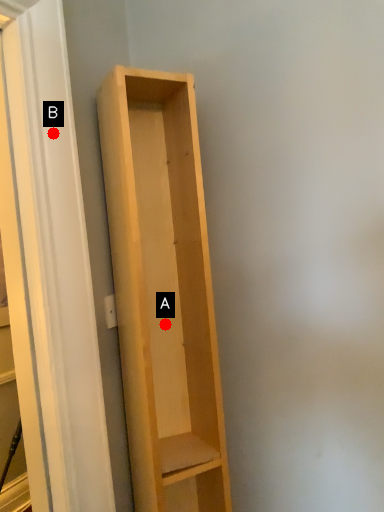
Question: Two points are circled on the image, labeled by A and B beside each circle. Which point appears closest to the camera in this image?

Choices:
 (A) A is closer
 (B) B is closer

Answer: (B)